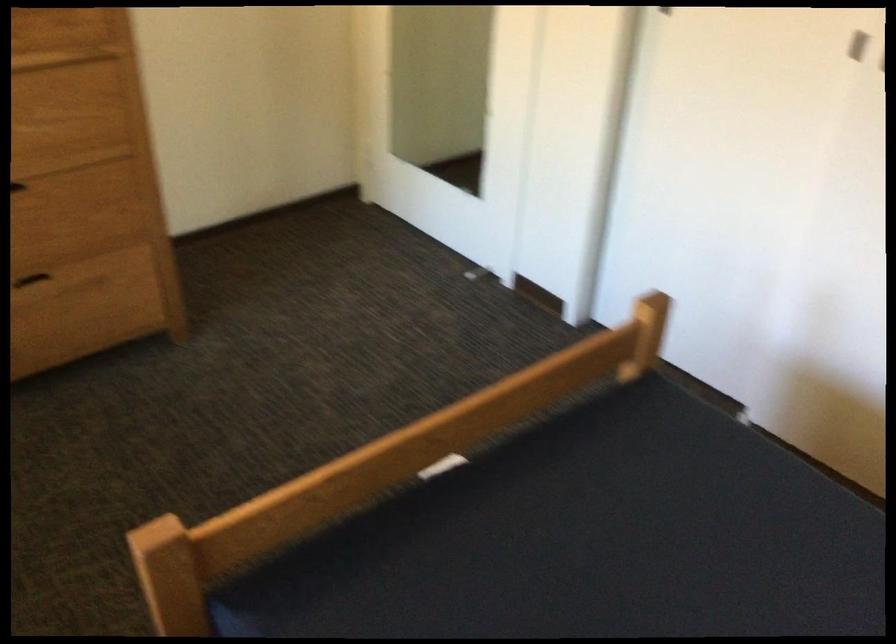
Describe the element at coordinates (427, 440) in the screenshot. The height and width of the screenshot is (644, 896). I see `the wooden bed rail` at that location.